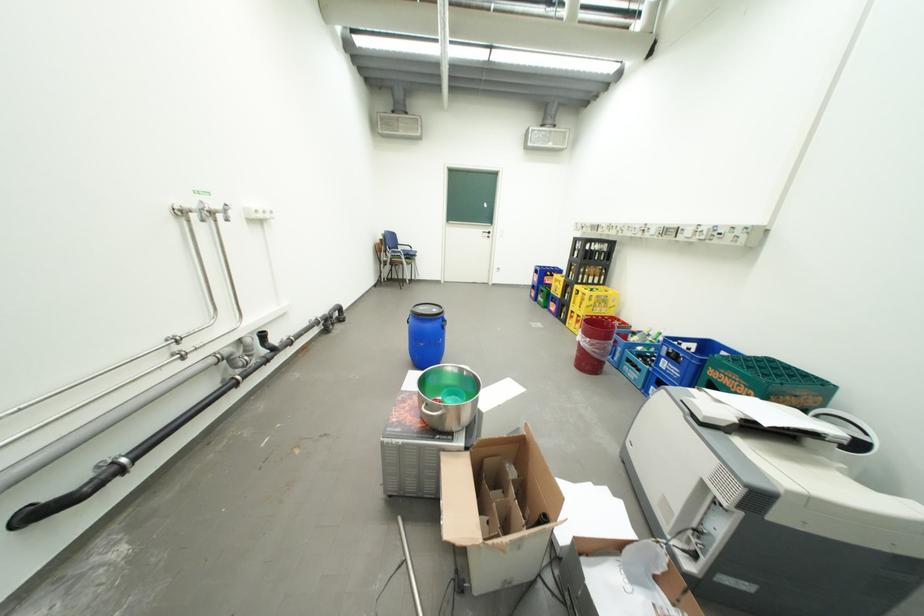
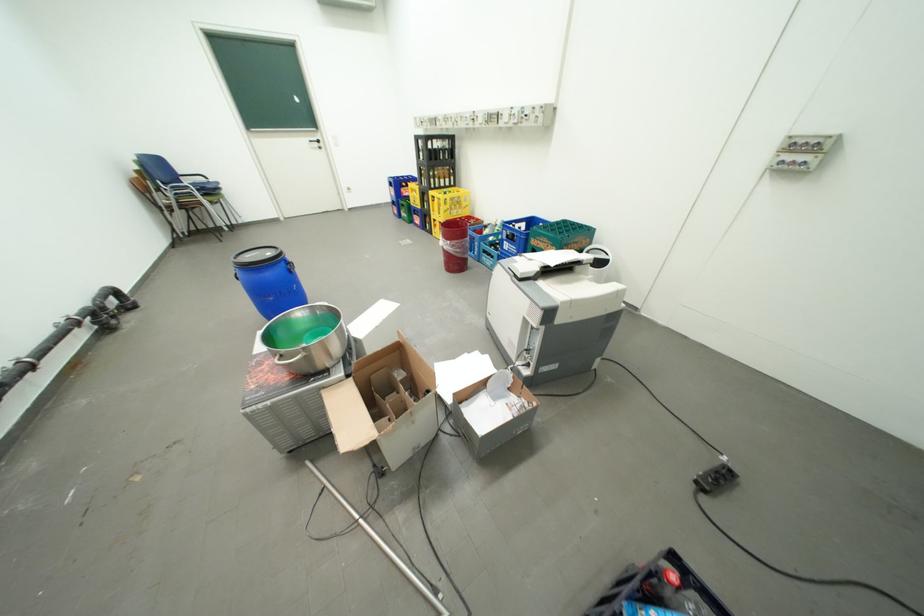
Where in the second image is the point corresponding to [599,341] from the first image?

(459, 243)